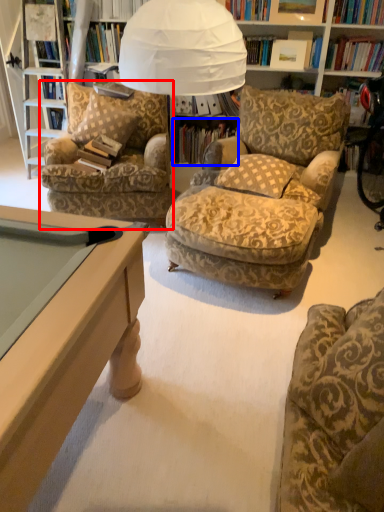
Question: Which object appears farthest to the camera in this image, chair (highlighted by a red box) or book (highlighted by a blue box)?

Choices:
 (A) chair
 (B) book

Answer: (B)